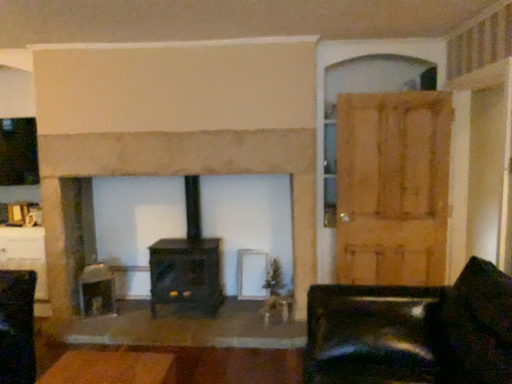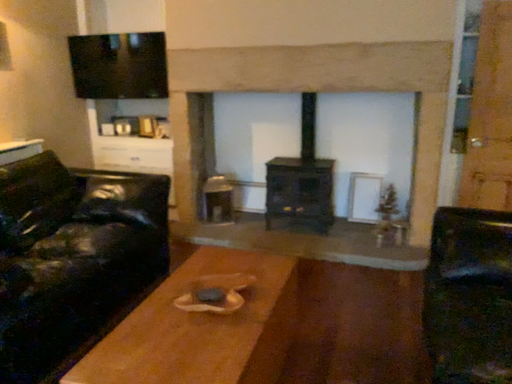
Question: How did the camera likely rotate when shooting the video?

Choices:
 (A) rotated left
 (B) rotated right

Answer: (A)